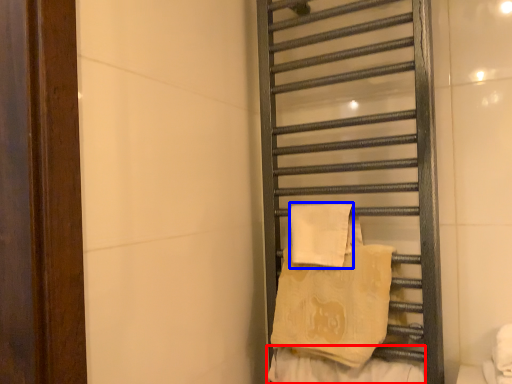
Question: Which of the following is the farthest to the observer, material (highlighted by a red box) or beach towel (highlighted by a blue box)?

Choices:
 (A) material
 (B) beach towel

Answer: (B)